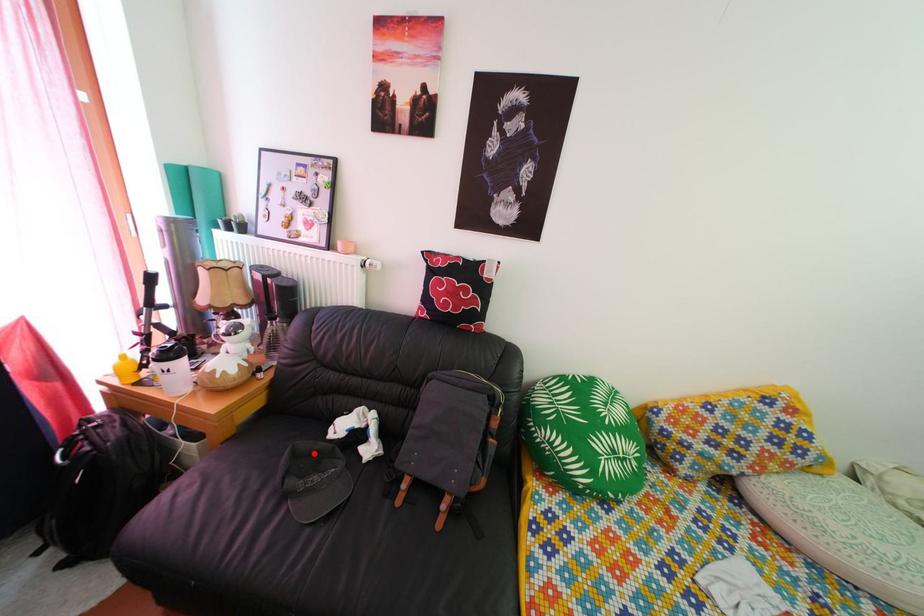
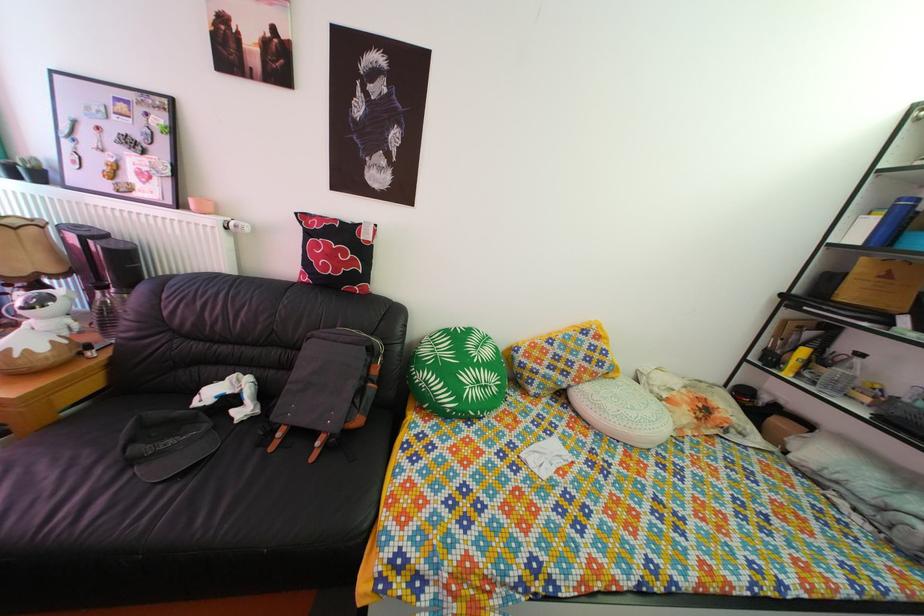
The point at the highlighted location is marked in the first image. Where is the corresponding point in the second image?

(166, 422)